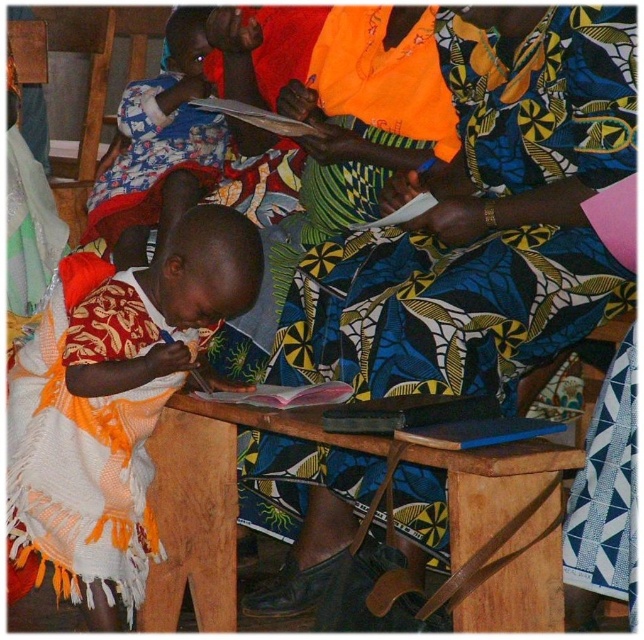
Question: Which object is positioned closest to the printed fabric skirt at center?

Choices:
 (A) wooden table at center
 (B) printed fabric cloth at upper left

Answer: (A)

Question: Is printed fabric skirt at center positioned before wooden table at center?

Choices:
 (A) no
 (B) yes

Answer: (A)

Question: Which of the following is the closest to the observer?

Choices:
 (A) (131, 320)
 (B) (533, 131)
 (C) (223, 145)

Answer: (A)

Question: Is wooden table at center thinner than printed fabric cloth at upper left?

Choices:
 (A) yes
 (B) no

Answer: (B)

Question: Which object appears closest to the camera in this image?

Choices:
 (A) wooden table at center
 (B) printed fabric cloth at upper left
 (C) printed fabric skirt at center
 (D) matte orange cloth at center

Answer: (A)

Question: Can you confirm if printed fabric skirt at center is wider than matte orange cloth at center?

Choices:
 (A) no
 (B) yes

Answer: (B)